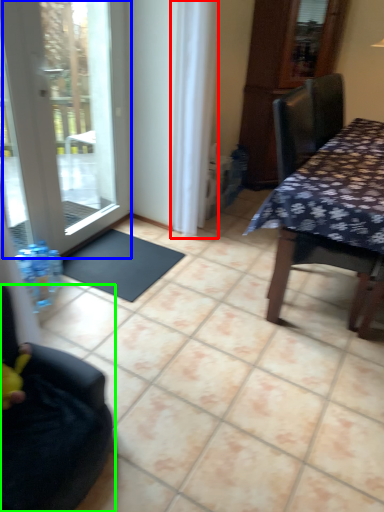
Question: Estimate the real-world distances between objects in this image. Which object is closer to curtain (highlighted by a red box), door (highlighted by a blue box) or chair (highlighted by a green box)?

Choices:
 (A) door
 (B) chair

Answer: (A)